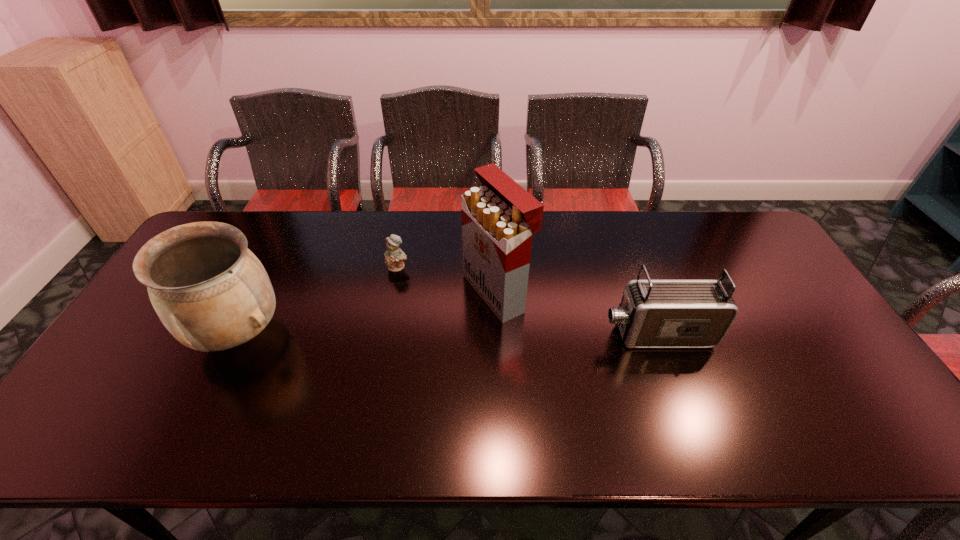
Image resolution: width=960 pixels, height=540 pixels. I want to click on the leftmost object, so click(209, 290).

Where is `the second tallest object`? The image size is (960, 540). the second tallest object is located at coordinates (209, 290).

The height and width of the screenshot is (540, 960). Identify the location of camcorder. [653, 313].

I want to click on the rightmost object, so click(x=653, y=313).

Find the location of a particular element. the shortest object is located at coordinates (394, 256).

This screenshot has height=540, width=960. Find the location of `the third object from right to left`. the third object from right to left is located at coordinates (394, 256).

Identify the location of cigarette case. (499, 218).

Locate an element on the screen. the tallest object is located at coordinates (499, 218).

Locate an element on the screen. The height and width of the screenshot is (540, 960). free space located 0.050m on the back of the urn is located at coordinates (261, 287).

At what (x,y) coordinates should I click in order to perform the action: click on vacant area situated 0.110m at the lens of the third tallest object. Please return your answer as a coordinate pair (x, y). Looking at the image, I should click on (561, 334).